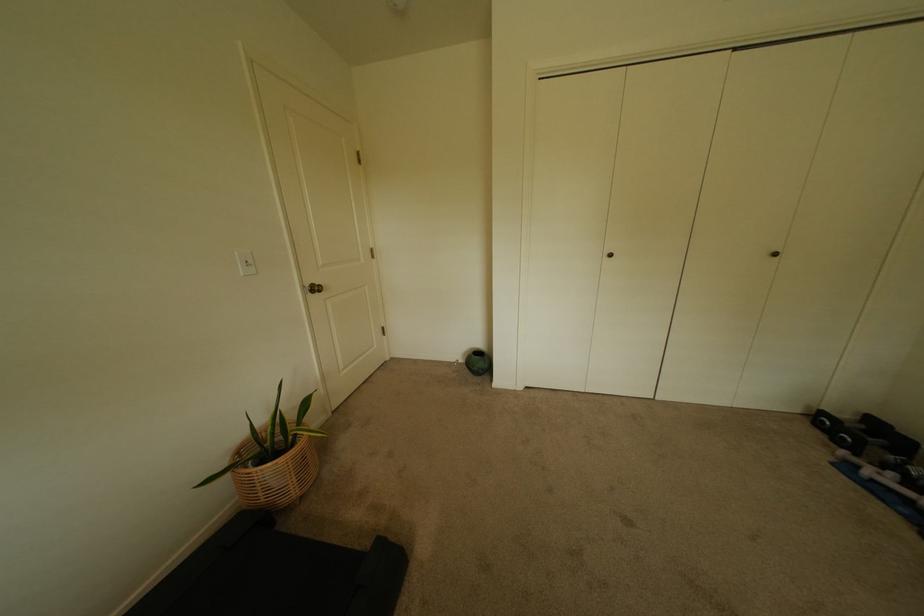
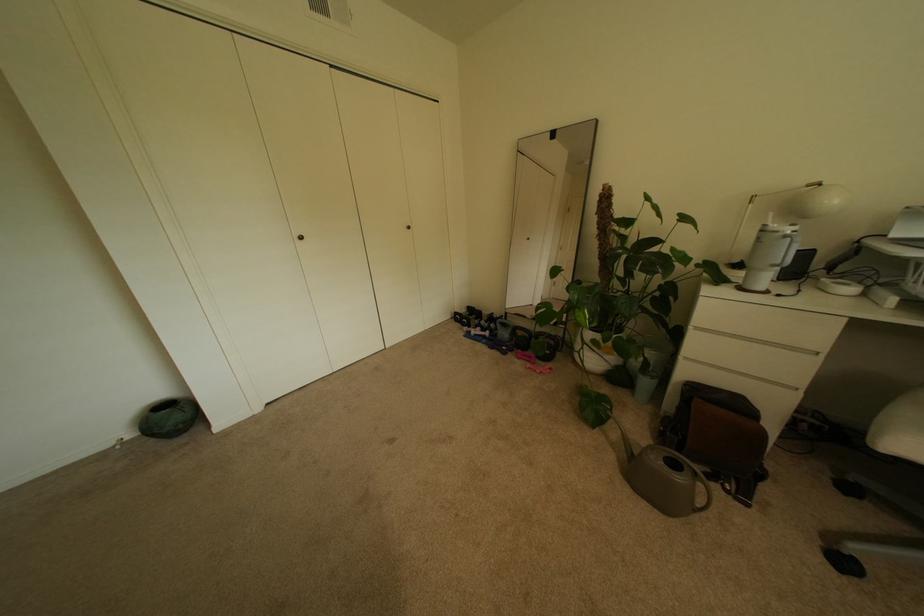
Question: How did the camera likely rotate?

Choices:
 (A) Left
 (B) Right
 (C) Up
 (D) Down

Answer: (B)